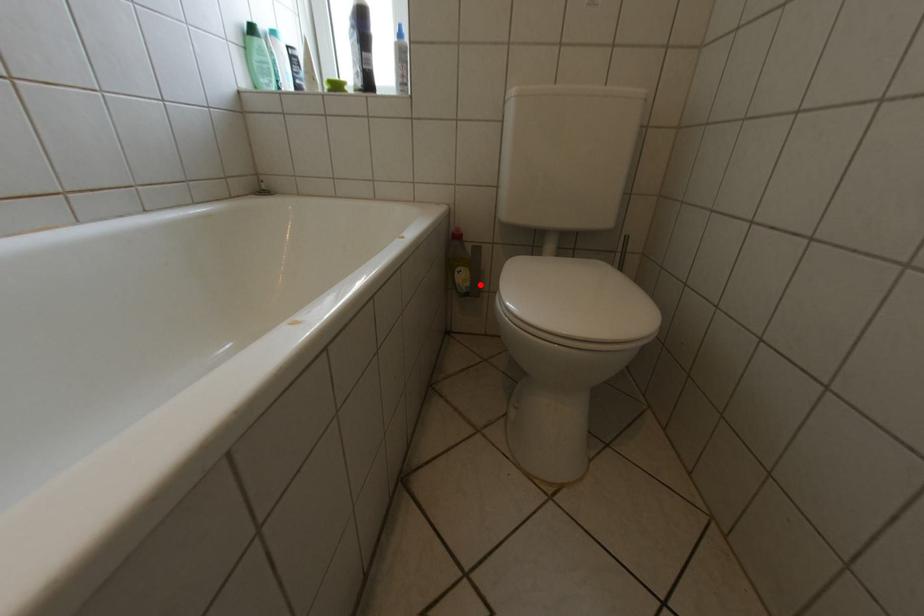
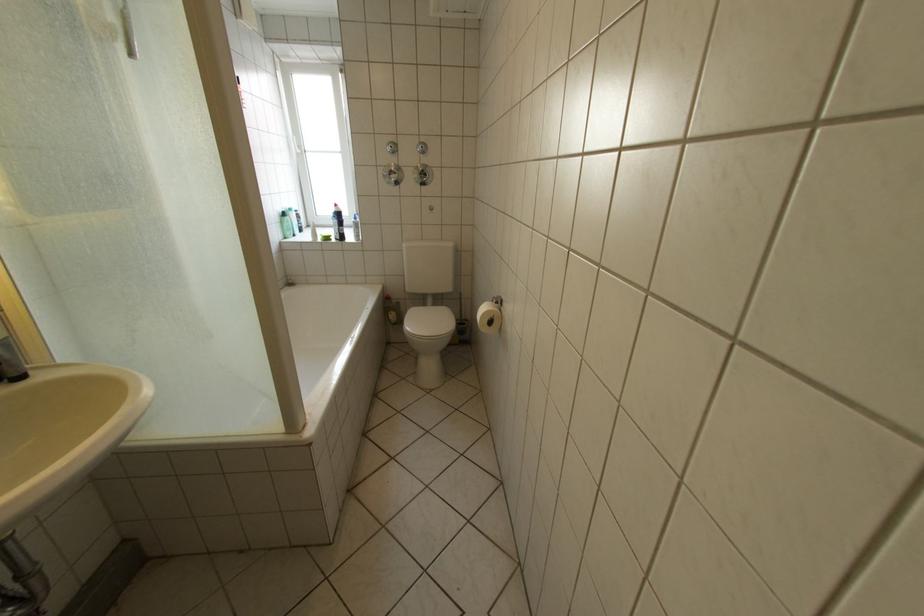
Question: I am providing you with two images of the same scene from different viewpoints. A red point is shown in image1. For the corresponding object point in image2, is it positioned nearer or farther from the camera?

Choices:
 (A) Nearer
 (B) Farther

Answer: (B)